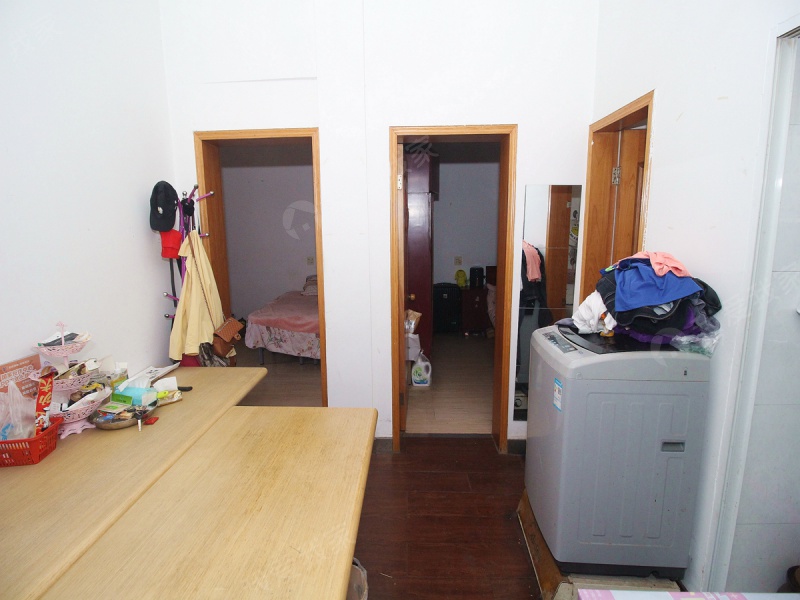
Locate an element on the screen. The height and width of the screenshot is (600, 800). basket and other items is located at coordinates (70, 388), (22, 446).